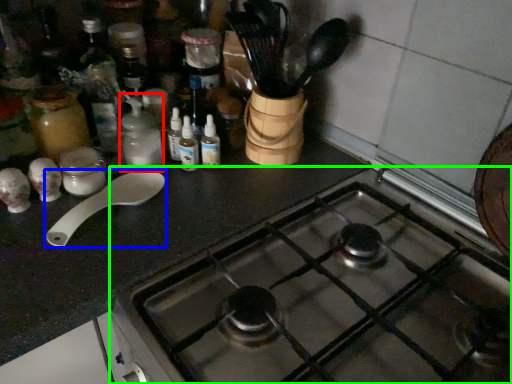
Question: Estimate the real-world distances between objects in this image. Which object is closer to bottle (highlighted by a red box), spoon (highlighted by a blue box) or gas stove (highlighted by a green box)?

Choices:
 (A) spoon
 (B) gas stove

Answer: (A)